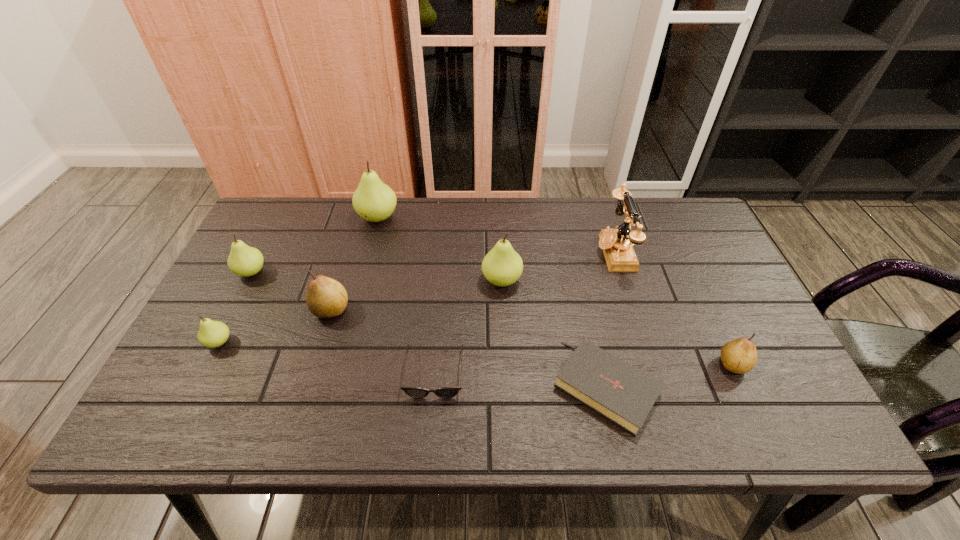
Where is `free point at the far edge`? free point at the far edge is located at coordinates (483, 211).

The image size is (960, 540). In the image, there is a desktop. In order to click on vacant space at the near edge in this screenshot , I will do `click(377, 401)`.

At what (x,y) coordinates should I click in order to perform the action: click on vacant space at the left edge. Please return your answer as a coordinate pair (x, y). The image size is (960, 540). Looking at the image, I should click on (226, 386).

Identify the location of free space at the right edge of the desktop. The image size is (960, 540). (692, 281).

In the image, there is a desktop. At what (x,y) coordinates should I click in order to perform the action: click on vacant area at the far right corner. Please return your answer as a coordinate pair (x, y). This screenshot has width=960, height=540. Looking at the image, I should click on (691, 230).

Where is `vacant space at the near right corner of the desktop`? vacant space at the near right corner of the desktop is located at coordinates (818, 431).

Where is `vacant area that lies between the third green pear from left to right and the bigger brown pear`? This screenshot has width=960, height=540. vacant area that lies between the third green pear from left to right and the bigger brown pear is located at coordinates (354, 264).

Where is `free space between the farthest pear and the second tallest pear`? free space between the farthest pear and the second tallest pear is located at coordinates (440, 249).

Where is `vacant space that's between the telephone and the nearest green pear`? vacant space that's between the telephone and the nearest green pear is located at coordinates [x=417, y=297].

What are the coordinates of `vacant point located between the telephone and the nearest green pear` in the screenshot? It's located at (417, 297).